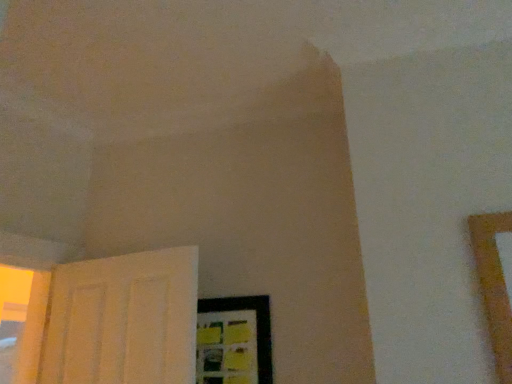
What do you see at coordinates (234, 341) in the screenshot?
I see `matte black picture frame at lower center` at bounding box center [234, 341].

The height and width of the screenshot is (384, 512). I want to click on matte black picture frame at lower center, so click(x=234, y=341).

This screenshot has height=384, width=512. I want to click on matte black picture frame at lower center, so click(x=234, y=341).